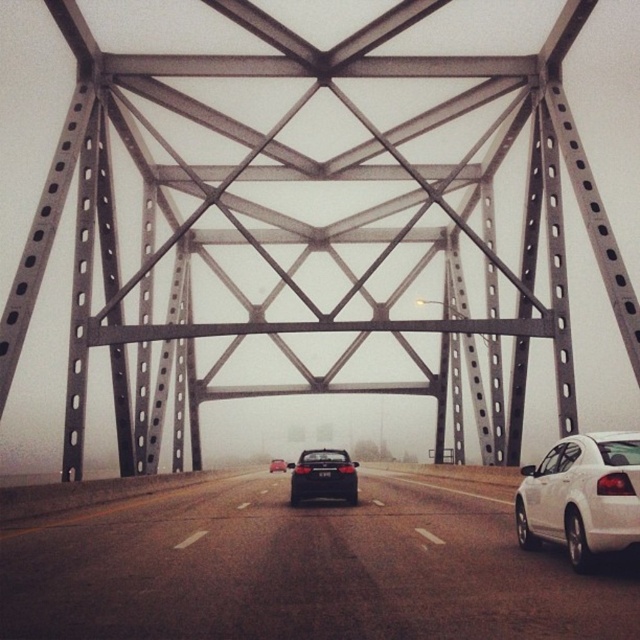
In the scene shown: Which of these two, smooth asphalt highway at center or matte black sedan at center, stands shorter?

matte black sedan at center is shorter.

Does point (333, 508) come farther from viewer compared to point (316, 461)?

No, it is in front of (316, 461).

Find the location of `smooth asphalt highway at center`. smooth asphalt highway at center is located at coordinates (301, 570).

Is matte black sedan at center positioned at the back of shiny black sedan at center?

No, matte black sedan at center is in front of shiny black sedan at center.

Consider the image. Does matte black sedan at center appear under shiny black sedan at center?

Actually, matte black sedan at center is above shiny black sedan at center.

Is point (320, 452) closer to viewer compared to point (278, 465)?

Yes.

Find the location of a particular element. Image resolution: width=640 pixels, height=640 pixels. matte black sedan at center is located at coordinates (323, 477).

Is smooth asphalt highway at center bigger than black plastic license plate at center?

Yes, smooth asphalt highway at center is bigger than black plastic license plate at center.

What do you see at coordinates (301, 570) in the screenshot? I see `smooth asphalt highway at center` at bounding box center [301, 570].

Is point (397, 547) closer to camera compared to point (326, 472)?

Yes, it is.

Locate an element on the screen. Image resolution: width=640 pixels, height=640 pixels. smooth asphalt highway at center is located at coordinates (301, 570).